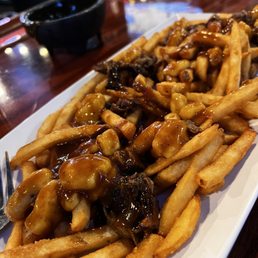
At what (x,y) coordinates should I click in order to perform the action: click on fork. Please return your answer as a coordinate pair (x, y). This screenshot has width=258, height=258. Looking at the image, I should click on (3, 215).